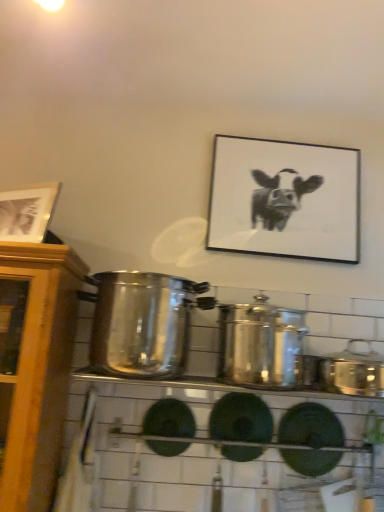
Question: Is wooden picture frame at upper left, the second picture frame when ordered from right to left, inside the boundaries of black matte picture frame at upper center, arranged as the first picture frame when viewed from the back, or outside?

Choices:
 (A) inside
 (B) outside

Answer: (B)

Question: Is wooden picture frame at upper left, the 1th picture frame from the left, in front of or behind black matte picture frame at upper center, positioned as the 1th picture frame in right-to-left order, in the image?

Choices:
 (A) behind
 (B) front

Answer: (B)

Question: Which object is positioned farthest from the wooden picture frame at upper left, the second picture frame when ordered from right to left?

Choices:
 (A) black matte picture frame at upper center, placed as the second picture frame when sorted from front to back
 (B) satin silver pot at center, placed as the first crock pot when sorted from left to right
 (C) satin silver crock pot at right, the third crock pot in the left-to-right sequence
 (D) shiny metallic crock pot at center, the second crock pot when ordered from right to left

Answer: (C)

Question: Which object is the closest to the satin silver pot at center, which is the third crock pot from right to left?

Choices:
 (A) wooden picture frame at upper left, the second picture frame when ordered from right to left
 (B) satin silver crock pot at right, the first crock pot in the right-to-left sequence
 (C) black matte picture frame at upper center, positioned as the 1th picture frame in right-to-left order
 (D) shiny metallic crock pot at center, acting as the 2th crock pot starting from the left

Answer: (D)